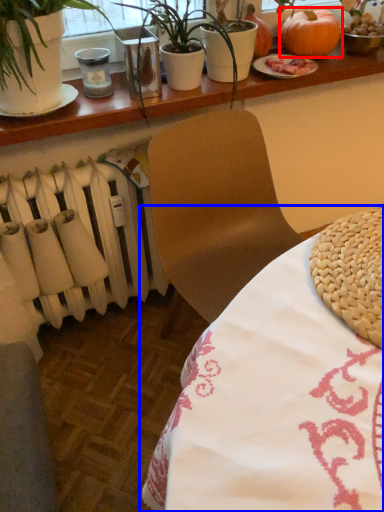
Question: Among these objects, which one is nearest to the camera, pumpkin (highlighted by a red box) or table (highlighted by a blue box)?

Choices:
 (A) pumpkin
 (B) table

Answer: (B)